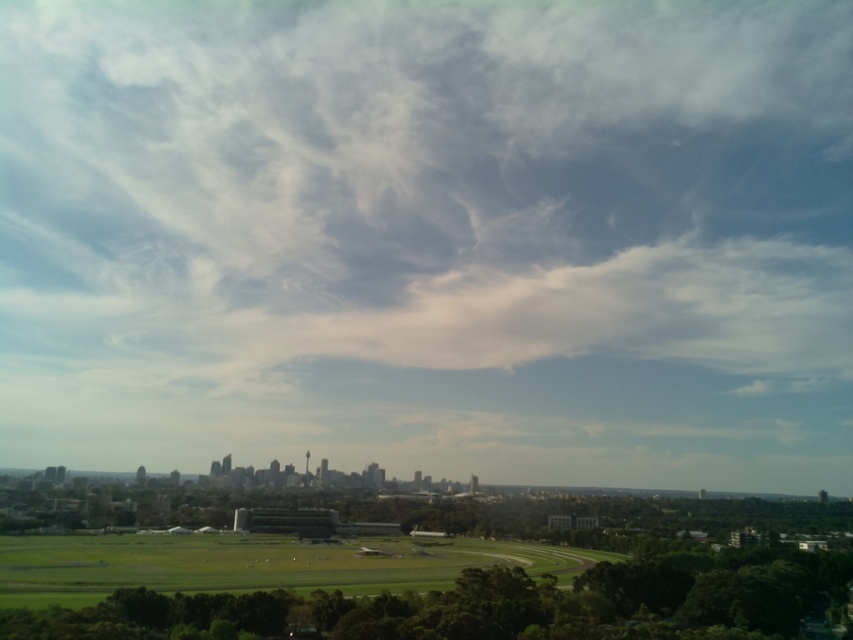
In the scene shown: You are standing in the cityscape and want to walk from the point at coordinates point [35,58] to the point at coordinates point [425,588]. Which point is closer to you when you start?

Point [35,58] is further to the viewer than point [425,588], so the starting point is farther away. Therefore, the point at coordinates point [425,588] is closer to you when you begin your walk.

You are a drone operator who needs to fly a drone from the green grassy field at lower center to the white cotton cloud at upper center. Considering the drone can only ascend vertically, will it be able to reach the cloud without moving horizontally?

The white cotton cloud at upper center is located above the green grassy field at lower center, so if the drone ascends vertically from the green grassy field at lower center, it will reach the white cotton cloud at upper center directly above it.